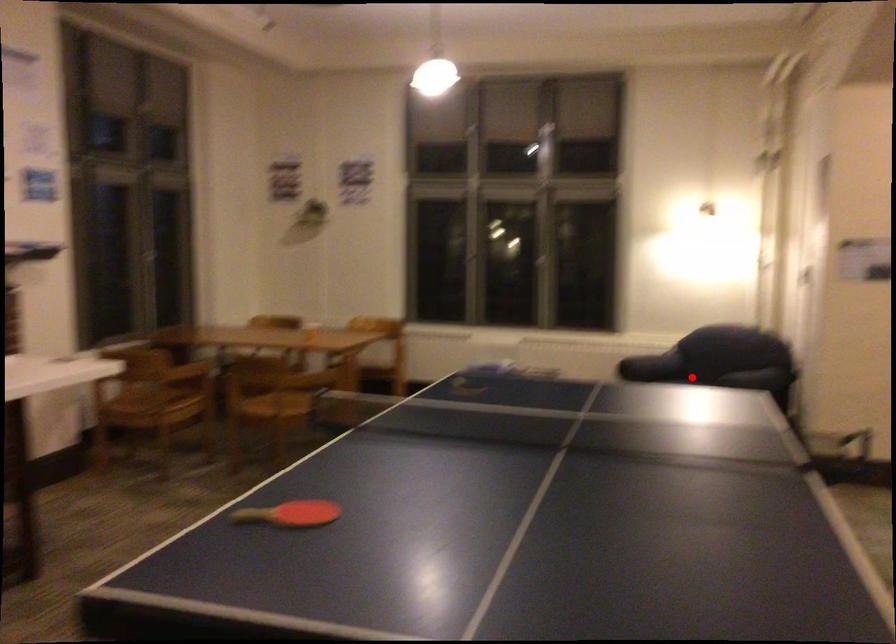
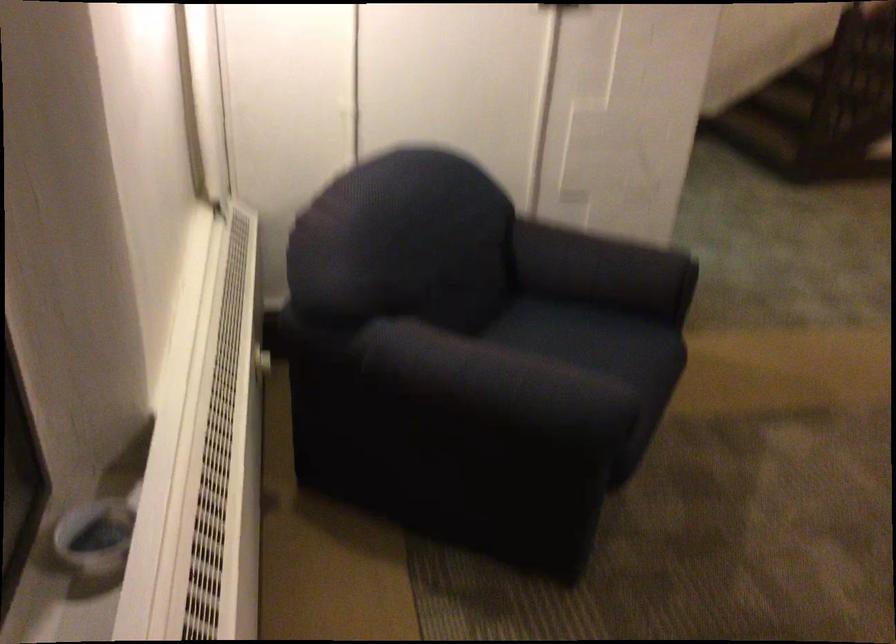
Where in the second image is the point corresponding to the highlighted location from the first image?

(601, 355)